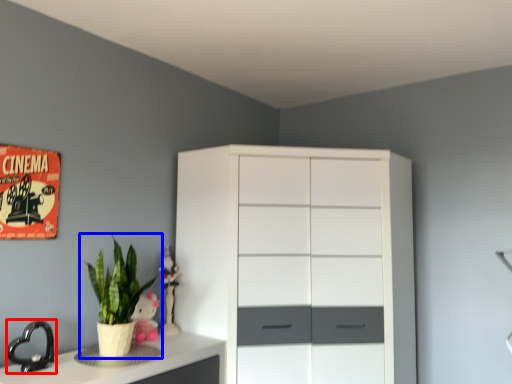
Question: Which of the following is the closest to the observer, faucet (highlighted by a red box) or houseplant (highlighted by a blue box)?

Choices:
 (A) faucet
 (B) houseplant

Answer: (A)